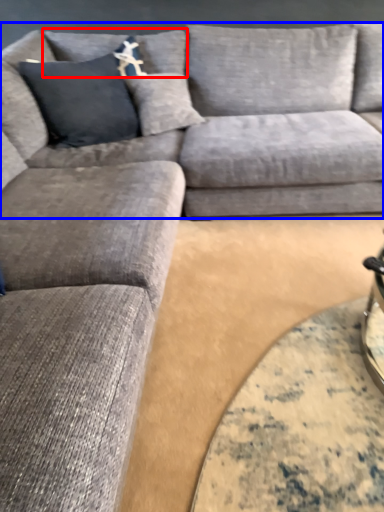
Question: Which object appears closest to the camera in this image, pillow (highlighted by a red box) or couch (highlighted by a blue box)?

Choices:
 (A) pillow
 (B) couch

Answer: (B)